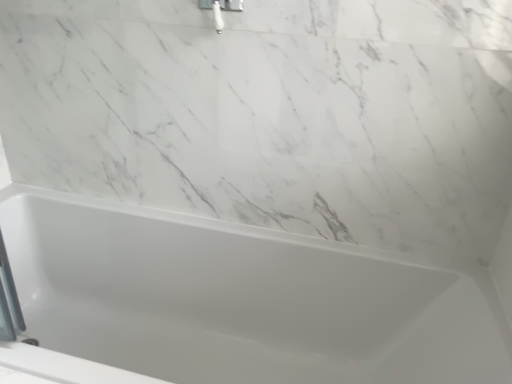
Question: Considering the relative positions of white glossy bathtub at center and white glossy shower head at upper center in the image provided, is white glossy bathtub at center to the right of white glossy shower head at upper center from the viewer's perspective?

Choices:
 (A) yes
 (B) no

Answer: (B)

Question: Does white glossy bathtub at center have a smaller size compared to white glossy shower head at upper center?

Choices:
 (A) no
 (B) yes

Answer: (A)

Question: Is white glossy bathtub at center taller than white glossy shower head at upper center?

Choices:
 (A) no
 (B) yes

Answer: (B)

Question: Can you confirm if white glossy bathtub at center is thinner than white glossy shower head at upper center?

Choices:
 (A) yes
 (B) no

Answer: (B)

Question: Does white glossy bathtub at center have a larger size compared to white glossy shower head at upper center?

Choices:
 (A) yes
 (B) no

Answer: (A)

Question: From the image's perspective, is white glossy bathtub at center on white glossy shower head at upper center?

Choices:
 (A) no
 (B) yes

Answer: (A)

Question: Could you tell me if white glossy shower head at upper center is turned towards white glossy bathtub at center?

Choices:
 (A) yes
 (B) no

Answer: (B)

Question: Considering the relative positions of white glossy shower head at upper center and white glossy bathtub at center in the image provided, is white glossy shower head at upper center in front of white glossy bathtub at center?

Choices:
 (A) no
 (B) yes

Answer: (A)

Question: Does white glossy shower head at upper center have a smaller size compared to white glossy bathtub at center?

Choices:
 (A) no
 (B) yes

Answer: (B)

Question: Does white glossy shower head at upper center appear on the left side of white glossy bathtub at center?

Choices:
 (A) yes
 (B) no

Answer: (B)

Question: Is white glossy bathtub at center surrounded by white glossy shower head at upper center?

Choices:
 (A) no
 (B) yes

Answer: (A)

Question: Is white glossy shower head at upper center bigger than white glossy bathtub at center?

Choices:
 (A) no
 (B) yes

Answer: (A)

Question: Would you say white glossy bathtub at center is to the left or to the right of white glossy shower head at upper center in the picture?

Choices:
 (A) left
 (B) right

Answer: (A)